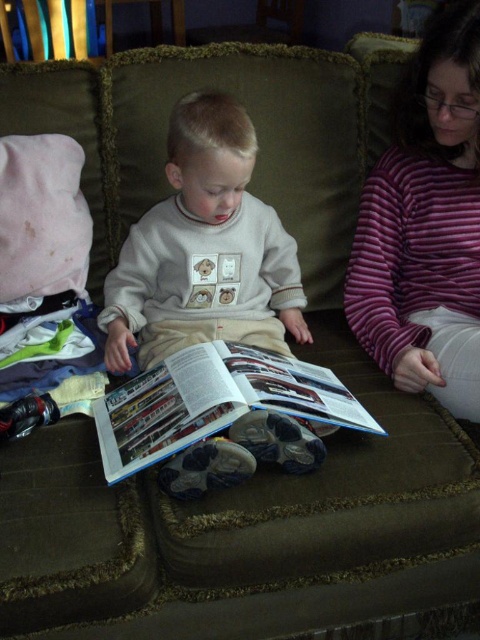
Who is more forward, (127, 288) or (300, 403)?

Point (300, 403)

In order to click on light gray cotton sweater at center in this screenshot , I will do `click(204, 250)`.

Can you confirm if purple striped sweater at upper right is positioned to the left of matte paper magazine at center?

Incorrect, purple striped sweater at upper right is not on the left side of matte paper magazine at center.

Is purple striped sweater at upper right closer to the viewer compared to matte paper magazine at center?

No, it is behind matte paper magazine at center.

Who is more forward, (408, 369) or (315, 387)?

Point (315, 387)

The height and width of the screenshot is (640, 480). I want to click on purple striped sweater at upper right, so click(x=427, y=227).

Image resolution: width=480 pixels, height=640 pixels. Describe the element at coordinates (204, 250) in the screenshot. I see `light gray cotton sweater at center` at that location.

Is point (190, 272) closer to camera compared to point (465, 214)?

Yes, point (190, 272) is closer to viewer.

Locate an element on the screen. Image resolution: width=480 pixels, height=640 pixels. light gray cotton sweater at center is located at coordinates (204, 250).